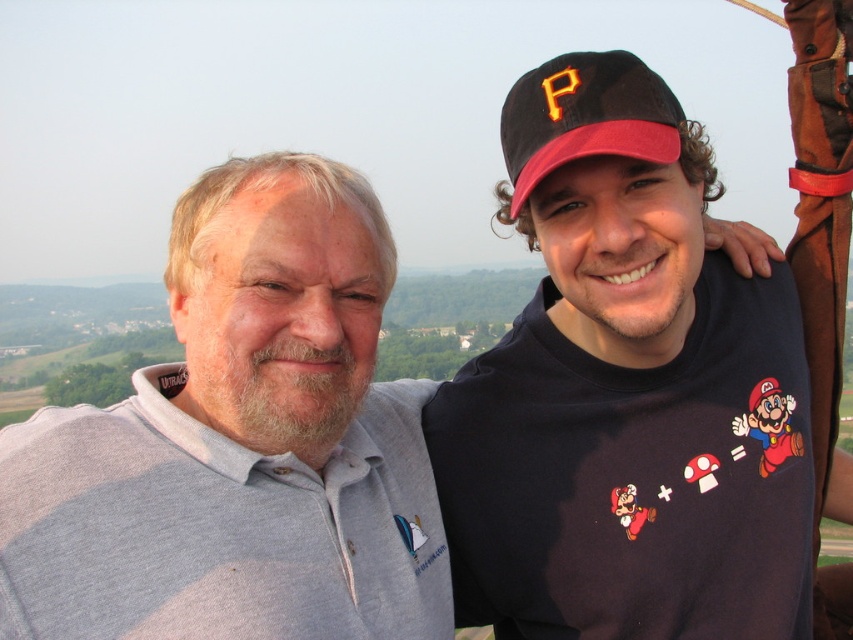
Who is higher up, gray cotton shirt at upper left or black fabric baseball cap at upper right?

black fabric baseball cap at upper right

Does point (341, 225) come closer to viewer compared to point (670, 129)?

No, (341, 225) is behind (670, 129).

The height and width of the screenshot is (640, 853). I want to click on gray cotton shirt at upper left, so click(241, 444).

Who is more forward, [799,416] or [82,499]?

Point [82,499] is in front.

Is point (497, 506) less distant than point (216, 404)?

Yes.

Where is `black matte cap at upper right`? The width and height of the screenshot is (853, 640). black matte cap at upper right is located at coordinates (625, 392).

Which is more to the right, black matte cap at upper right or black fabric baseball cap at upper right?

From the viewer's perspective, black matte cap at upper right appears more on the right side.

Is point (521, 531) more distant than point (544, 92)?

No.

Identify the location of black matte cap at upper right. Image resolution: width=853 pixels, height=640 pixels. (625, 392).